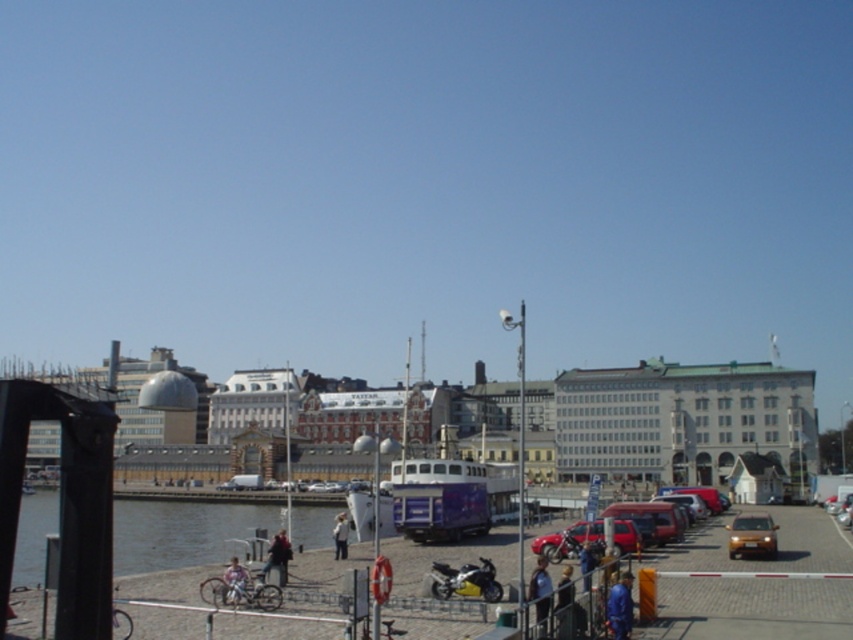
Measure the distance between clear water at lower left and blue denim jeans at lower center.

clear water at lower left is 58.34 meters away from blue denim jeans at lower center.

Does clear water at lower left have a lesser width compared to blue denim jeans at lower center?

No, clear water at lower left is not thinner than blue denim jeans at lower center.

Image resolution: width=853 pixels, height=640 pixels. Find the location of `clear water at lower left`. clear water at lower left is located at coordinates (183, 532).

Does point (190, 538) lie in front of point (845, 520)?

No.

Is clear water at lower left below shiny gold car at lower right?

Yes, clear water at lower left is below shiny gold car at lower right.

Measure the distance between clear water at lower left and camera.

clear water at lower left and camera are 41.01 meters apart.

Locate an element on the screen. This screenshot has width=853, height=640. clear water at lower left is located at coordinates (183, 532).

Does blue fabric jacket at lower center lie in front of light blue denim jacket at lower right?

Yes, it is in front of light blue denim jacket at lower right.

The width and height of the screenshot is (853, 640). What do you see at coordinates (540, 593) in the screenshot?
I see `blue fabric jacket at lower center` at bounding box center [540, 593].

Where is `blue fabric jacket at lower center`? This screenshot has width=853, height=640. blue fabric jacket at lower center is located at coordinates (540, 593).